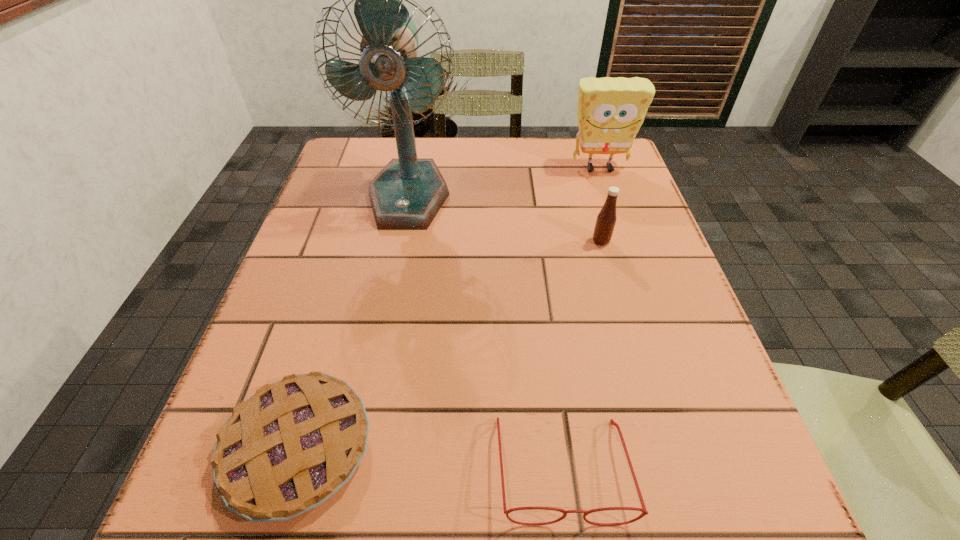
Image resolution: width=960 pixels, height=540 pixels. I want to click on object at the near left corner, so click(x=285, y=450).

Where is `object located in the far right corner section of the desktop`? The width and height of the screenshot is (960, 540). object located in the far right corner section of the desktop is located at coordinates (610, 112).

Locate an element on the screen. The width and height of the screenshot is (960, 540). free space at the far edge of the desktop is located at coordinates (478, 159).

Image resolution: width=960 pixels, height=540 pixels. I want to click on vacant space at the left edge of the desktop, so click(299, 268).

Locate an element on the screen. This screenshot has width=960, height=540. free space at the right edge of the desktop is located at coordinates (678, 352).

Where is `vacant space at the far left corner of the desktop`? Image resolution: width=960 pixels, height=540 pixels. vacant space at the far left corner of the desktop is located at coordinates (337, 165).

In the image, there is a desktop. Find the location of `vacant space at the far right corner`. vacant space at the far right corner is located at coordinates (569, 146).

Locate an element on the screen. The height and width of the screenshot is (540, 960). free space between the second tallest object and the pie is located at coordinates (449, 308).

This screenshot has height=540, width=960. In order to click on unoccupied area between the fan and the spectacles in this screenshot , I will do `click(485, 332)`.

Identify the location of vacant area that lies between the third object from left to right and the shortest object. (430, 458).